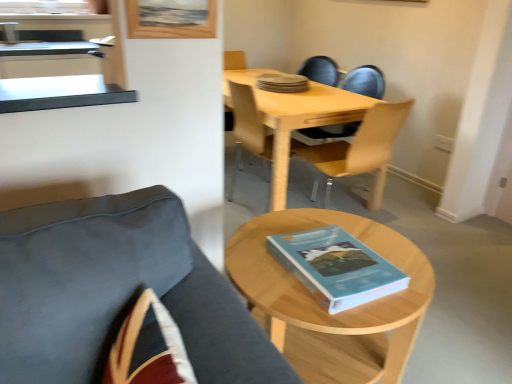
Question: Does point (261, 112) appear closer or farther from the camera than point (352, 296)?

Choices:
 (A) closer
 (B) farther

Answer: (B)

Question: Is light wood/transparent plastic chair at center, the first chair in the back-to-front sequence, in front of or behind blue matte book at center, marked as the 1th book in a bottom-to-top arrangement, in the image?

Choices:
 (A) front
 (B) behind

Answer: (B)

Question: Considering the real-world distances, which object is closest to the wooden picture frame at upper center?

Choices:
 (A) light wood/wooden table at center
 (B) light wood/transparent plastic chair at center, positioned as the third chair in front-to-back order
 (C) blue matte book at center, which ranks as the first book in top-to-bottom order
 (D) light wood/woodenobject at lower right
 (E) velvet dark blue chair at lower left, placed as the first chair when sorted from front to back

Answer: (E)

Question: Which is nearer to the blue matte book at center, which is the 2th book from front to back?

Choices:
 (A) light wood/wooden chair at center, the 2th chair viewed from the back
 (B) light wood/woodenobject at lower right
 (C) velvet dark blue chair at lower left, placed as the first chair when sorted from front to back
 (D) light wood/wooden table at center
 (E) blue matte book at center, marked as the 1th book in a bottom-to-top arrangement

Answer: (D)